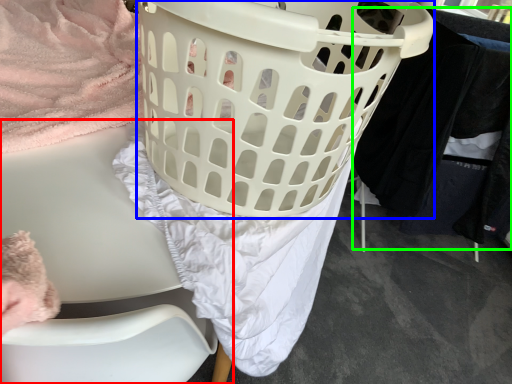
Question: Which object is the farthest from furniture (highlighted by a red box)? Choose among these: basket (highlighted by a blue box) or clothing (highlighted by a green box).

Choices:
 (A) basket
 (B) clothing

Answer: (B)